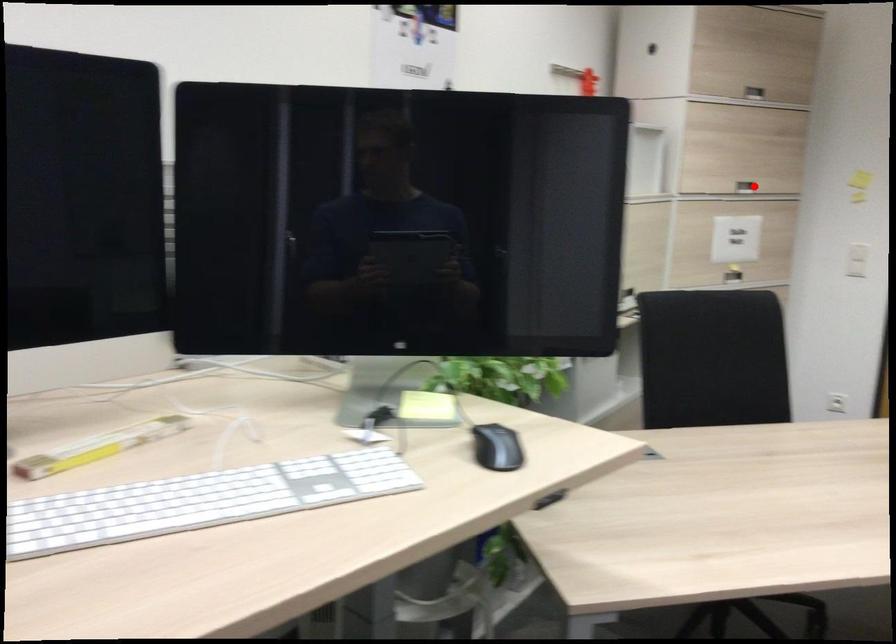
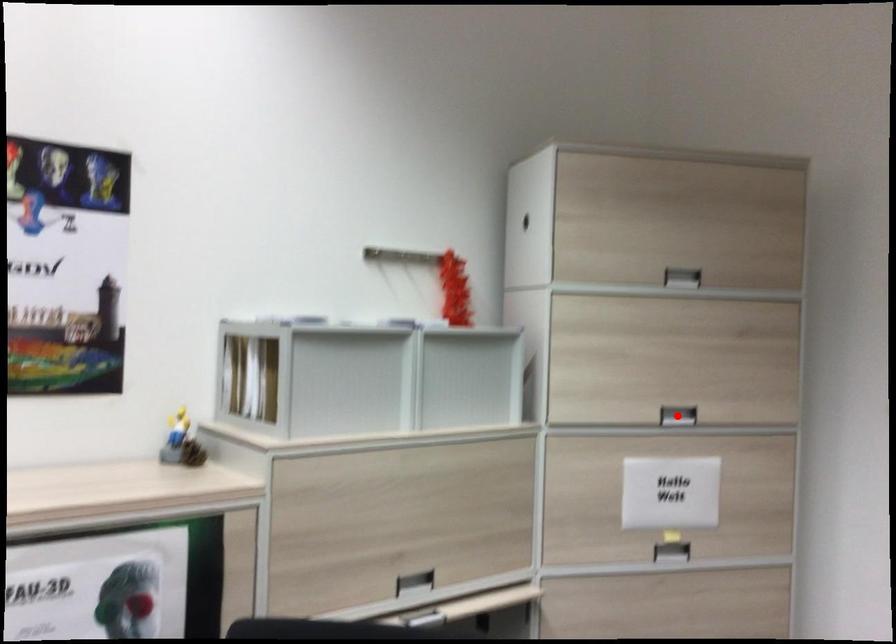
I am providing you with two images of the same scene from different viewpoints. A red point is marked on the first image and another point is marked on the second image. Is the marked point in image1 the same physical position as the marked point in image2?

Yes